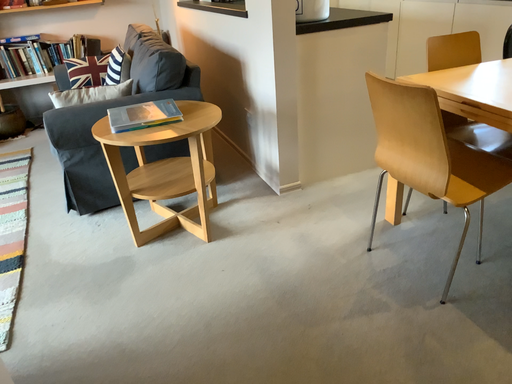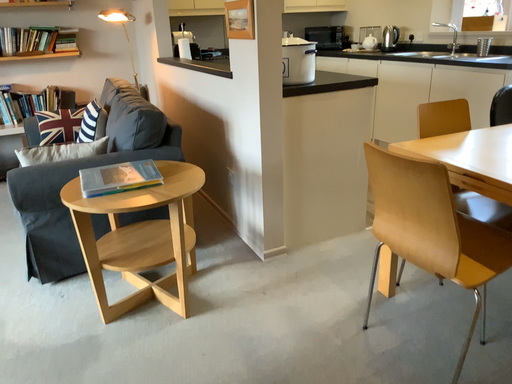
Question: How did the camera likely rotate when shooting the video?

Choices:
 (A) rotated upward
 (B) rotated downward

Answer: (A)